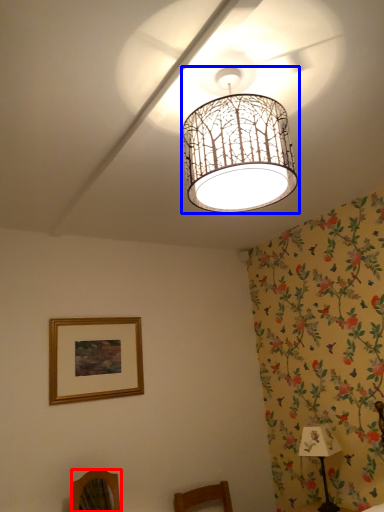
Question: Which object is closer to the camera taking this photo, furniture (highlighted by a red box) or lamp (highlighted by a blue box)?

Choices:
 (A) furniture
 (B) lamp

Answer: (B)